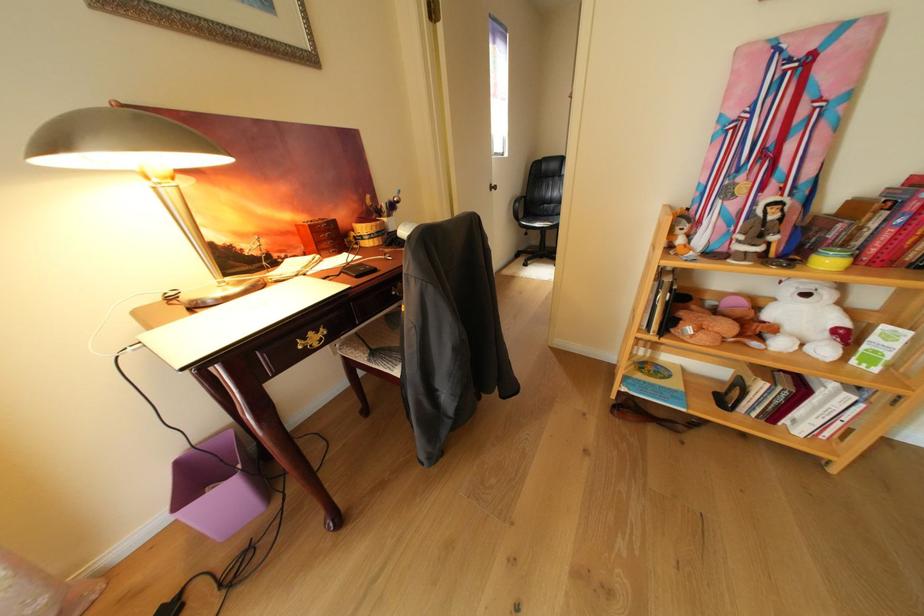
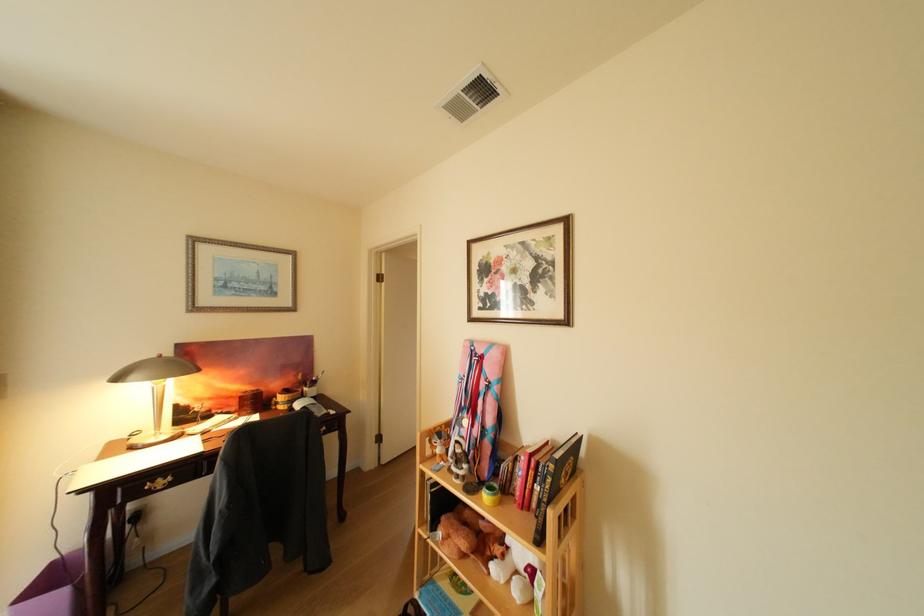
The point at (695, 315) is marked in the first image. Where is the corresponding point in the second image?

(456, 519)